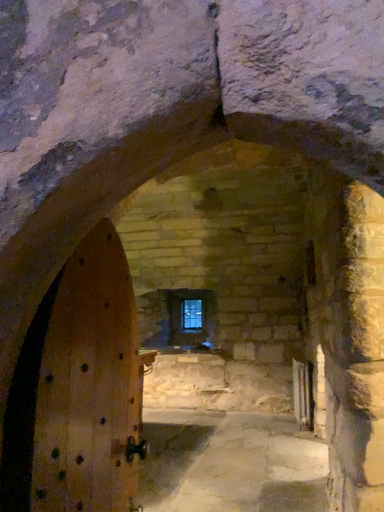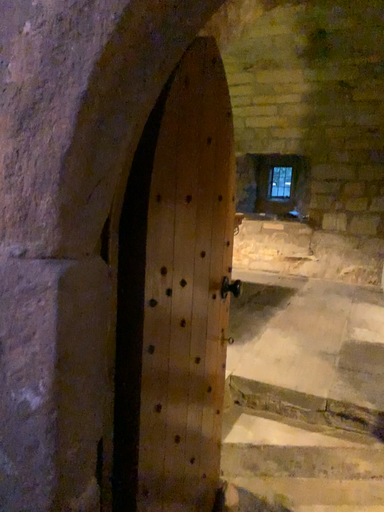
Question: How did the camera likely rotate when shooting the video?

Choices:
 (A) rotated right
 (B) rotated left

Answer: (B)